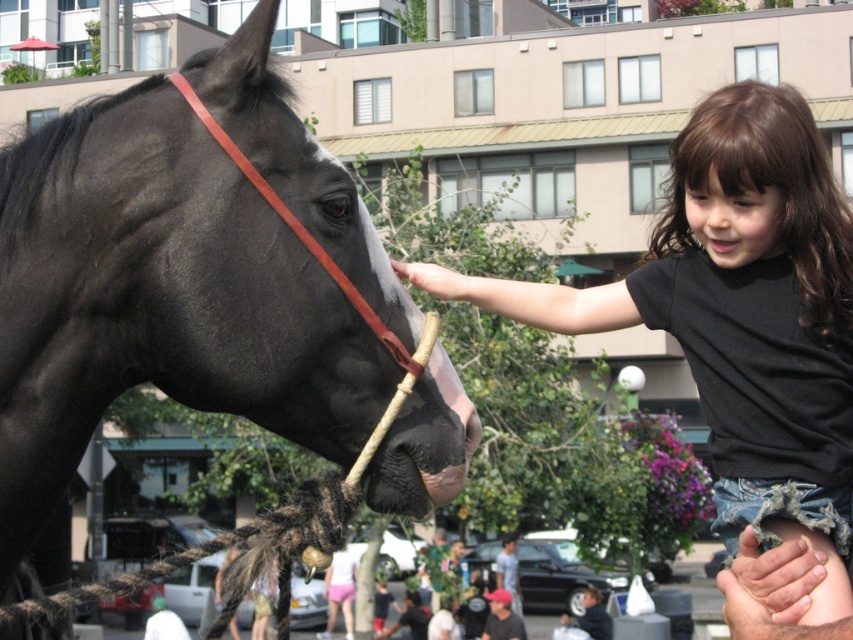
Question: Based on their relative distances, which object is nearer to the dark gray baseball cap at lower center?

Choices:
 (A) gray fabric shirt at lower center
 (B) black glossy horse at left
 (C) black t-shirt at upper right

Answer: (A)

Question: Which object is positioned farthest from the dark gray baseball cap at lower center?

Choices:
 (A) black glossy horse at left
 (B) gray fabric shirt at lower center

Answer: (A)

Question: Can you confirm if black t-shirt at upper right is positioned to the right of gray fabric shirt at lower center?

Choices:
 (A) yes
 (B) no

Answer: (B)

Question: Can you confirm if black t-shirt at upper right is wider than gray fabric shirt at lower center?

Choices:
 (A) yes
 (B) no

Answer: (A)

Question: Observing the image, what is the correct spatial positioning of black glossy horse at left in reference to dark gray baseball cap at lower center?

Choices:
 (A) right
 (B) left

Answer: (B)

Question: Which object is farther from the camera taking this photo?

Choices:
 (A) gray fabric shirt at lower center
 (B) black glossy horse at left
 (C) black t-shirt at upper right
 (D) dark gray baseball cap at lower center

Answer: (A)